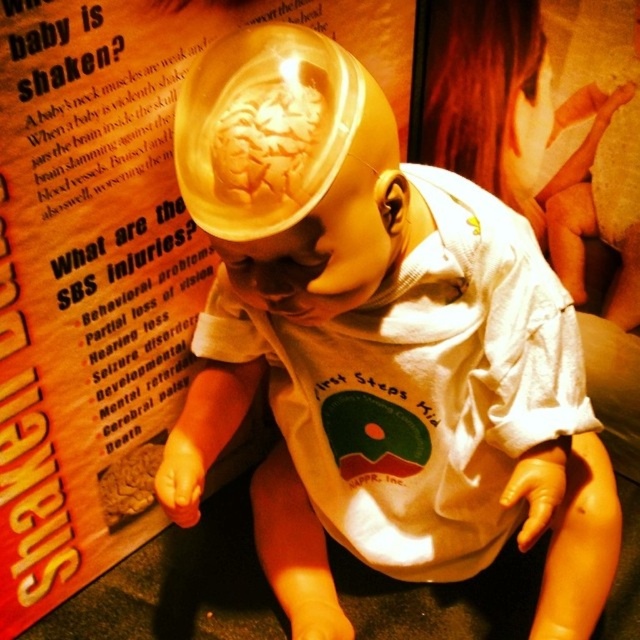
Does matte plastic head at center have a larger size compared to matte paper poster at center?

No, matte plastic head at center is not bigger than matte paper poster at center.

Between matte plastic head at center and matte paper poster at center, which one has less height?

matte plastic head at center

Does point (211, 236) come closer to viewer compared to point (4, 163)?

Yes, it is.

Where is `matte plastic head at center`? matte plastic head at center is located at coordinates pos(385,358).